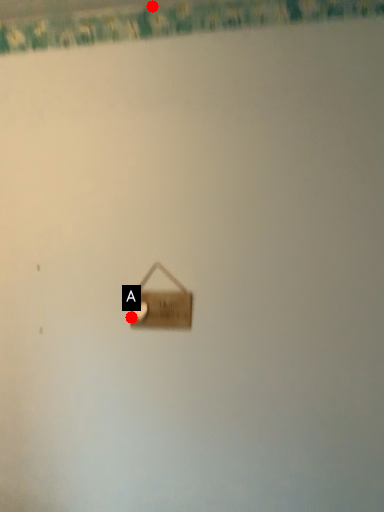
Question: Two points are circled on the image, labeled by A and B beside each circle. Which of the following is the farthest from the observer?

Choices:
 (A) A is further
 (B) B is further

Answer: (B)